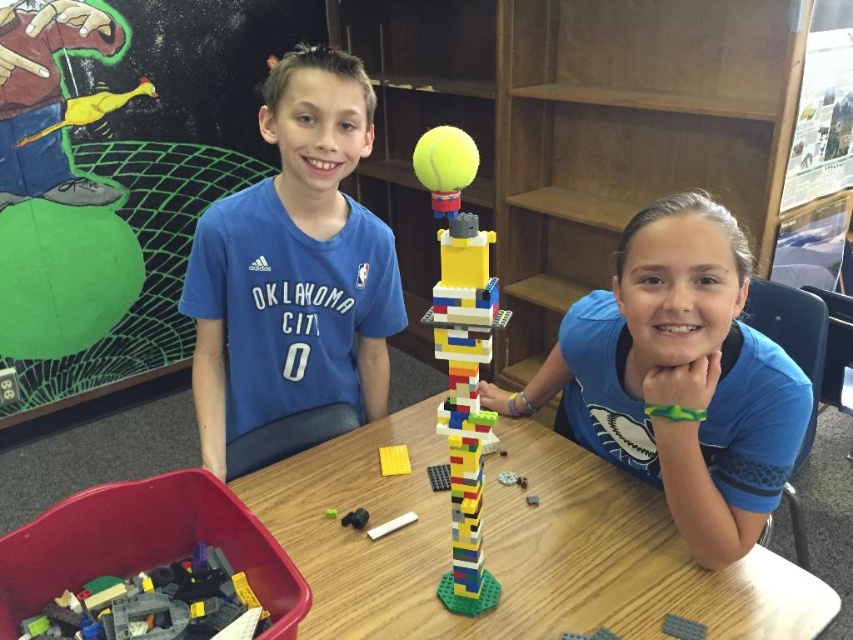
Which is above, yellow matte rubber duck at upper left or matte black plastic block at center?

yellow matte rubber duck at upper left is higher up.

Is yellow matte rubber duck at upper left to the left of matte black plastic block at center from the viewer's perspective?

Yes, yellow matte rubber duck at upper left is to the left of matte black plastic block at center.

Is point (107, 100) closer to camera compared to point (358, 522)?

No, (107, 100) is behind (358, 522).

What are the coordinates of `yellow matte rubber duck at upper left` in the screenshot? It's located at (90, 108).

Does blue jersey at center have a larger size compared to smooth plastic piece at center?

Yes, blue jersey at center is bigger than smooth plastic piece at center.

Identify the location of blue jersey at center. (294, 266).

Measure the distance between point (287, 90) and camera.

1.27 meters

Identify the location of blue jersey at center. The width and height of the screenshot is (853, 640). (294, 266).

Can you confirm if blue jersey at center is bigger than yellow matte square at center?

Yes.

In order to click on blue jersey at center in this screenshot , I will do `click(294, 266)`.

Locate an element on the screen. blue jersey at center is located at coordinates click(x=294, y=266).